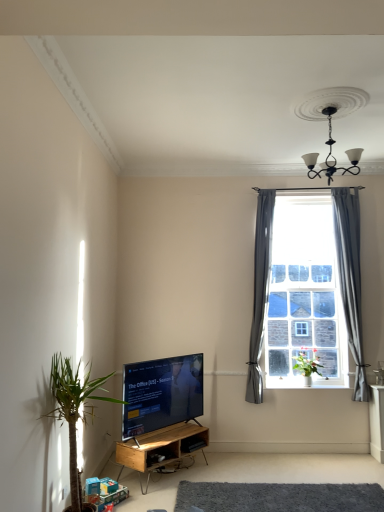
The image size is (384, 512). Describe the element at coordinates (260, 291) in the screenshot. I see `gray fabric curtain at right, which ranks as the 2th curtain in right-to-left order` at that location.

At what (x,y) coordinates should I click in order to perform the action: click on gray fabric curtain at right, which is the first curtain from right to left. Please return your answer as a coordinate pair (x, y). Image resolution: width=384 pixels, height=512 pixels. Looking at the image, I should click on (350, 277).

Identify the location of green leafy plant at lower left, placed as the 2th houseplant when sorted from back to front. (x=74, y=408).

What do you see at coordinates (74, 408) in the screenshot? Image resolution: width=384 pixels, height=512 pixels. I see `green leafy plant at lower left, the first houseplant from the left` at bounding box center [74, 408].

You are a GUI agent. You are given a task and a screenshot of the screen. Output one action in this format:
    pyautogui.click(x=<x>, y=<y>)
    Task: Click on the gray carpet at lower center
    The height and width of the screenshot is (512, 384).
    Given the screenshot: What is the action you would take?
    pyautogui.click(x=278, y=497)

What is the approximate height of clear glass window at center?

7.79 feet.

In order to face woodenmaterial/textureshelf at lower center, should I rotate leftwards or rightwards?

To align with it, rotate left about 3.543°.

This screenshot has height=512, width=384. What do you see at coordinates (161, 394) in the screenshot?
I see `black glossy tv at lower center` at bounding box center [161, 394].

I want to click on gray fabric curtain at right, which ranks as the first curtain in left-to-right order, so click(260, 291).

Measure the distance between gray fabric curtain at right, which ranks as the first curtain in left-to-right order, and green leafy plant at lower left, the first houseplant from the left.

The distance of gray fabric curtain at right, which ranks as the first curtain in left-to-right order, from green leafy plant at lower left, the first houseplant from the left, is 9.23 feet.

Does point (260, 352) appear closer or farther from the camera than point (62, 403)?

Point (260, 352) appears to be farther away from the viewer than point (62, 403).

Is gray fabric curtain at right, which ranks as the first curtain in left-to-right order, located outside green leafy plant at lower left, the 2th houseplant from the right?

Yes, gray fabric curtain at right, which ranks as the first curtain in left-to-right order, is outside of green leafy plant at lower left, the 2th houseplant from the right.

Is there a large distance between gray fabric curtain at right, which ranks as the 2th curtain in right-to-left order, and green leafy plant at lower left, the 2th houseplant from the right?

Yes, gray fabric curtain at right, which ranks as the 2th curtain in right-to-left order, is far from green leafy plant at lower left, the 2th houseplant from the right.

Which is more to the left, black wrought iron chandelier at upper right or gray fabric curtain at right, which is the first curtain from right to left?

Positioned to the left is black wrought iron chandelier at upper right.

From the image's perspective, does black wrought iron chandelier at upper right appear lower than gray fabric curtain at right, which is the first curtain from right to left?

Actually, black wrought iron chandelier at upper right appears above gray fabric curtain at right, which is the first curtain from right to left, in the image.

From a real-world perspective, which is physically below, black wrought iron chandelier at upper right or gray fabric curtain at right, which is the first curtain from right to left?

gray fabric curtain at right, which is the first curtain from right to left.

Does black glossy tv at lower center have a larger size compared to woodenmaterial/textureshelf at lower center?

Yes.

Do you think black glossy tv at lower center is within woodenmaterial/textureshelf at lower center, or outside of it?

black glossy tv at lower center exists outside the volume of woodenmaterial/textureshelf at lower center.

This screenshot has width=384, height=512. I want to click on shelf that is under the black glossy tv at lower center (from a real-world perspective), so click(x=162, y=448).

Is gray carpet at lower center facing away from green glossy plant at window, acting as the second houseplant starting from the left?

That's not correct — gray carpet at lower center is not looking away from green glossy plant at window, acting as the second houseplant starting from the left.

Is gray carpet at lower center at the right side of green glossy plant at window, the 1th houseplant when ordered from back to front?

No, gray carpet at lower center is not to the right of green glossy plant at window, the 1th houseplant when ordered from back to front.

At what (x,y) coordinates should I click in order to perform the action: click on plain that is below the green glossy plant at window, which is the first houseplant in right-to-left order (from the image's perspective). Please return your answer as a coordinate pair (x, y). The width and height of the screenshot is (384, 512). Looking at the image, I should click on (278, 497).

Is green glossy plant at window, arranged as the 2th houseplant when viewed from the front, completely or partially inside gray carpet at lower center?

No, green glossy plant at window, arranged as the 2th houseplant when viewed from the front, is not inside gray carpet at lower center.

The image size is (384, 512). What are the coordinates of `bay window that appears on the right of black wrought iron chandelier at upper right` in the screenshot? It's located at (304, 322).

Which is behind, point (322, 110) or point (292, 326)?

The point (292, 326) is farther.

Is black wrought iron chandelier at upper right oriented towards clear glass window at center?

No.

Does black wrought iron chandelier at upper right have a lesser width compared to clear glass window at center?

In fact, black wrought iron chandelier at upper right might be wider than clear glass window at center.

Where is `the 2nd houseplant positioned below the black wrought iron chandelier at upper right (from a real-world perspective)`? This screenshot has height=512, width=384. the 2nd houseplant positioned below the black wrought iron chandelier at upper right (from a real-world perspective) is located at coordinates (74, 408).

In the scene shown: Are black wrought iron chandelier at upper right and green leafy plant at lower left, the 1th houseplant positioned from the front, far apart?

black wrought iron chandelier at upper right is far away from green leafy plant at lower left, the 1th houseplant positioned from the front.

Which is more to the left, black wrought iron chandelier at upper right or green leafy plant at lower left, the 1th houseplant positioned from the front?

green leafy plant at lower left, the 1th houseplant positioned from the front.

From the image's perspective, does gray carpet at lower center appear higher than woodenmaterial/textureshelf at lower center?

No, from the image's perspective, gray carpet at lower center is not on top of woodenmaterial/textureshelf at lower center.

Which is more to the left, gray carpet at lower center or woodenmaterial/textureshelf at lower center?

woodenmaterial/textureshelf at lower center is more to the left.

Is gray carpet at lower center not close to woodenmaterial/textureshelf at lower center?

That's not correct — gray carpet at lower center is a little close to woodenmaterial/textureshelf at lower center.

Is gray carpet at lower center taller or shorter than woodenmaterial/textureshelf at lower center?

gray carpet at lower center is shorter than woodenmaterial/textureshelf at lower center.

The width and height of the screenshot is (384, 512). What are the coordinates of `the 1st curtain above the green leafy plant at lower left, the 2th houseplant from the right (from the image's perspective)` in the screenshot? It's located at (260, 291).

Image resolution: width=384 pixels, height=512 pixels. There is a black wrought iron chandelier at upper right. What are the coordinates of `the 1st curtain below it (from the image's perspective)` in the screenshot? It's located at tap(350, 277).

From the image, which object appears to be nearer to black glossy tv at lower center, green glossy plant at window, acting as the second houseplant starting from the left, or gray fabric curtain at right, which is the first curtain from right to left?

green glossy plant at window, acting as the second houseplant starting from the left, is positioned closer to the anchor black glossy tv at lower center.

When comparing their distances from clear glass window at center, does green leafy plant at lower left, placed as the 2th houseplant when sorted from back to front, or gray fabric curtain at right, which ranks as the first curtain in left-to-right order, seem closer?

gray fabric curtain at right, which ranks as the first curtain in left-to-right order, lies closer to clear glass window at center than the other object.

From the image, which object appears to be farther from black glossy tv at lower center, green glossy plant at window, which is the first houseplant in right-to-left order, or gray carpet at lower center?

green glossy plant at window, which is the first houseplant in right-to-left order.

Estimate the real-world distances between objects in this image. Which object is closer to gray carpet at lower center, gray fabric curtain at right, which ranks as the 2th curtain in right-to-left order, or green glossy plant at window, which is the first houseplant in right-to-left order?

gray fabric curtain at right, which ranks as the 2th curtain in right-to-left order, is closer to gray carpet at lower center.

Estimate the real-world distances between objects in this image. Which object is closer to black glossy tv at lower center, gray carpet at lower center or woodenmaterial/textureshelf at lower center?

Based on the image, woodenmaterial/textureshelf at lower center appears to be nearer to black glossy tv at lower center.

When comparing their distances from clear glass window at center, does black wrought iron chandelier at upper right or black glossy tv at lower center seem further?

Among the two, black wrought iron chandelier at upper right is located further to clear glass window at center.

Based on their spatial positions, is green glossy plant at window, the 1th houseplant when ordered from back to front, or clear glass window at center closer to gray fabric curtain at right, which ranks as the first curtain in left-to-right order?

Among the two, clear glass window at center is located nearer to gray fabric curtain at right, which ranks as the first curtain in left-to-right order.

Estimate the real-world distances between objects in this image. Which object is further from black wrought iron chandelier at upper right, gray carpet at lower center or woodenmaterial/textureshelf at lower center?

gray carpet at lower center lies further to black wrought iron chandelier at upper right than the other object.

You are a GUI agent. You are given a task and a screenshot of the screen. Output one action in this format:
    pyautogui.click(x=<x>, y=<y>)
    Task: Click on the bay window between black wrought iron chandelier at upper right and black glossy tv at lower center vertically
    The image size is (384, 512).
    Given the screenshot: What is the action you would take?
    pyautogui.click(x=304, y=322)

Find the location of a particular element. bay window between gray fabric curtain at right, which ranks as the first curtain in left-to-right order, and gray fabric curtain at right, positioned as the second curtain in left-to-right order, in the horizontal direction is located at coordinates (304, 322).

In order to click on television between green leafy plant at lower left, placed as the 2th houseplant when sorted from back to front, and gray fabric curtain at right, which ranks as the 2th curtain in right-to-left order, in the front-back direction in this screenshot , I will do `click(161, 394)`.

You are a GUI agent. You are given a task and a screenshot of the screen. Output one action in this format:
    pyautogui.click(x=<x>, y=<y>)
    Task: Click on the curtain located between green leafy plant at lower left, the first houseplant from the left, and gray fabric curtain at right, positioned as the second curtain in left-to-right order, in the left-right direction
    
    Given the screenshot: What is the action you would take?
    pyautogui.click(x=260, y=291)